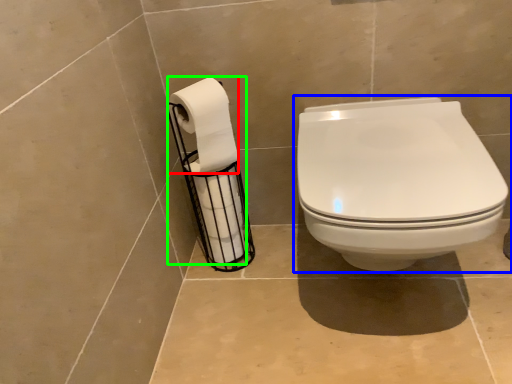
Question: Which object is the farthest from toilet paper (highlighted by a red box)? Choose among these: toilet (highlighted by a blue box) or toilet paper (highlighted by a green box).

Choices:
 (A) toilet
 (B) toilet paper

Answer: (A)